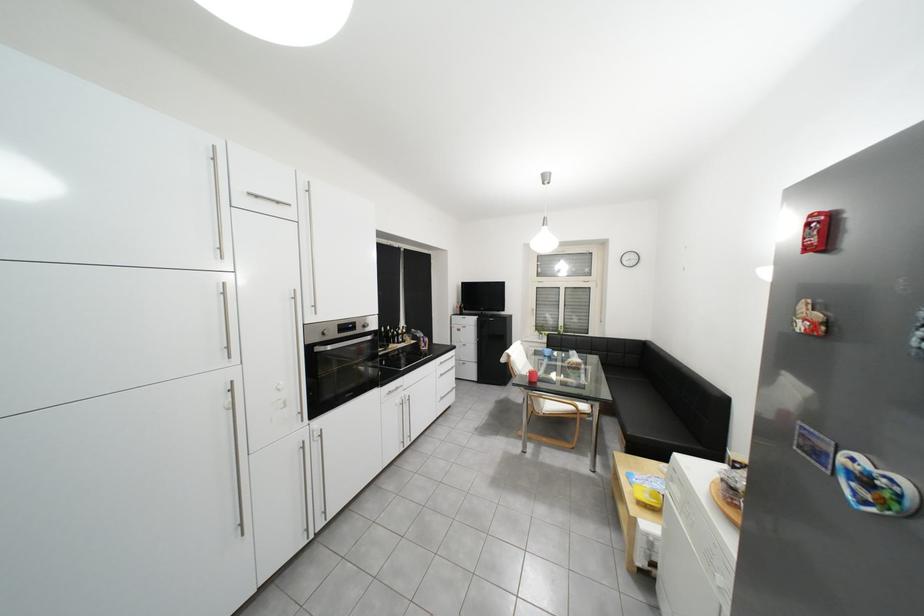
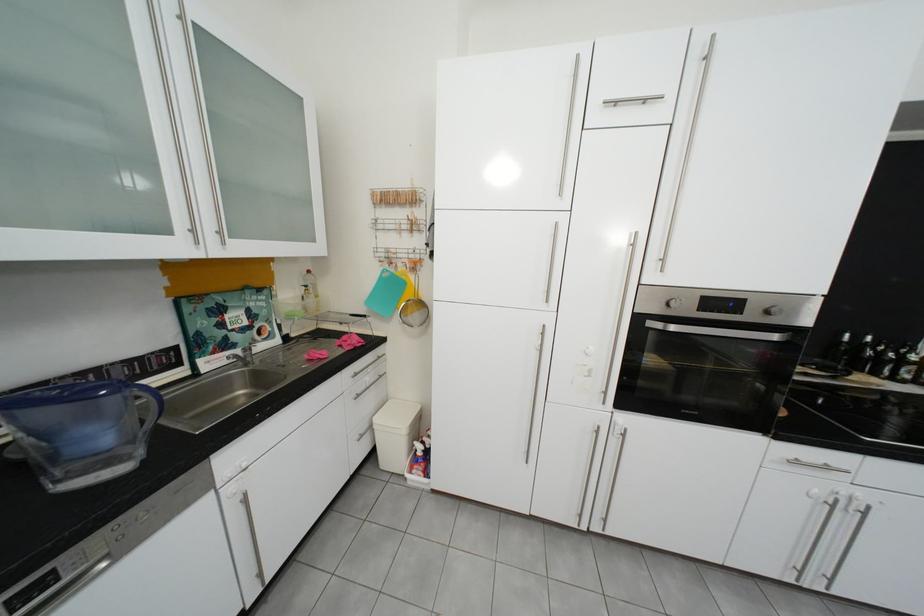
Locate, in the second image, the point that corresponds to point 406,344 in the first image.

(886, 375)